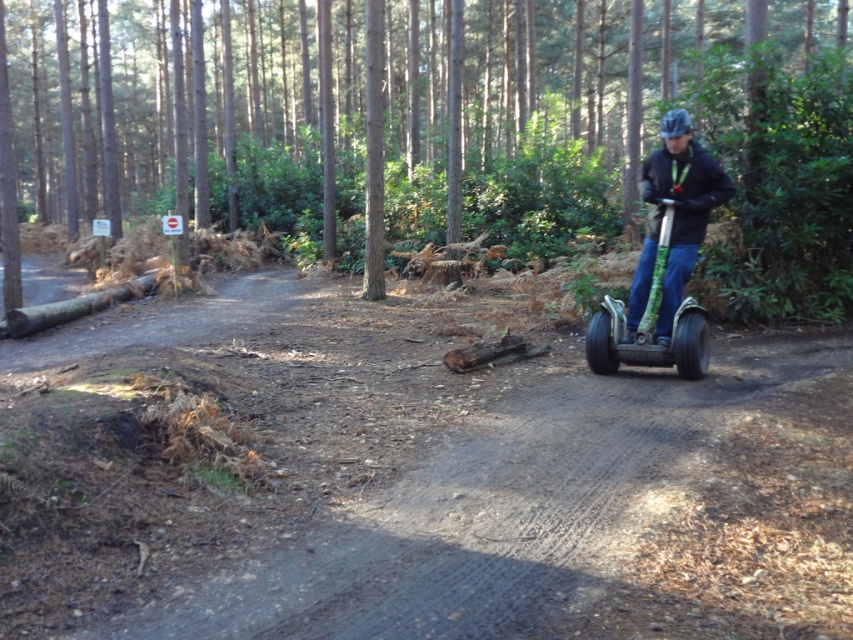
You are standing at the point marked by the coordinate point at [688,257]. You want to walk to the Segway rider who is 6.20 meters away. How many steps would you need to take if each step is 0.75 meters long?

To determine the number of steps needed to cover 6.20 meters with each step being 0.75 meters long, divide the total distance by the step length. 6.20 divided by 0.75 equals approximately 8.27 steps. Since you can only take whole steps, you would need to take 9 steps to reach the Segway rider.

Consider the image. You are planning to ride the green textured segway at right along the brown dirt track at center. Based on the scene description, will the segway fit comfortably on the track?

The brown dirt track at center has a lesser width compared to the green textured segway at right, so the segway may not fit comfortably on the track as it is wider than the track itself.

You are a hiker on the forest path and see both the green textured scooter at right and the green textured segway at right. Which one is smaller in size?

The green textured scooter at right is smaller in size compared to the green textured segway at right.